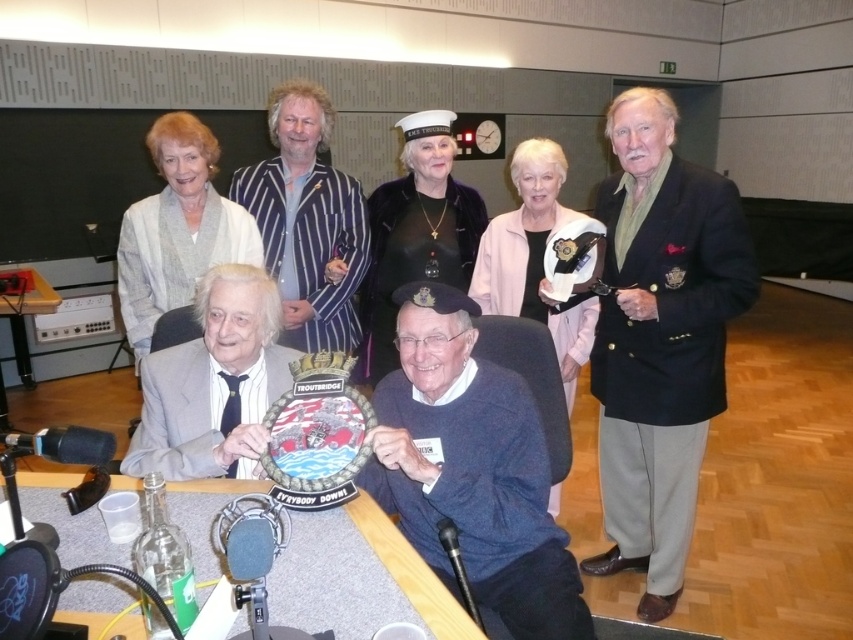
Is point (376, 536) more distant than point (515, 177)?

No, it is in front of (515, 177).

Who is lower down, wooden table at center or pink fabric jacket at upper center?

wooden table at center

Does point (350, 516) come closer to viewer compared to point (561, 157)?

That is True.

I want to click on wooden table at center, so click(x=358, y=577).

Which is more to the right, gray fabric suit at lower left or black velvet dress at center?

black velvet dress at center

Between gray fabric suit at lower left and black velvet dress at center, which one is positioned lower?

gray fabric suit at lower left is lower down.

Is point (151, 358) positioned in front of point (486, 220)?

Yes, point (151, 358) is in front of point (486, 220).

Where is `gray fabric suit at lower left`? gray fabric suit at lower left is located at coordinates (213, 384).

Who is more forward, (509, 394) or (229, 429)?

Point (509, 394) is in front.

Is blue wool sweater at center above gray fabric suit at lower left?

No, blue wool sweater at center is not above gray fabric suit at lower left.

Find the location of a particular element. Image resolution: width=853 pixels, height=640 pixels. blue wool sweater at center is located at coordinates tap(471, 468).